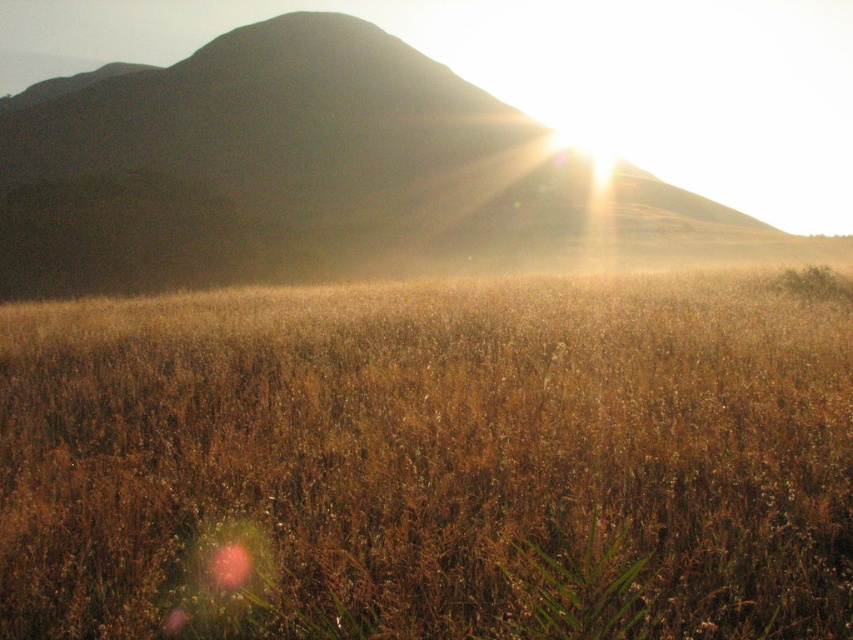
Question: Which of the following is the farthest from the observer?

Choices:
 (A) golden grassy field at center
 (B) silhouetted rock formation at upper center

Answer: (B)

Question: Can you confirm if golden grassy field at center is wider than silhouetted rock formation at upper center?

Choices:
 (A) no
 (B) yes

Answer: (A)

Question: Is golden grassy field at center below silhouetted rock formation at upper center?

Choices:
 (A) no
 (B) yes

Answer: (B)

Question: Can you confirm if golden grassy field at center is thinner than silhouetted rock formation at upper center?

Choices:
 (A) no
 (B) yes

Answer: (B)

Question: Among these objects, which one is farthest from the camera?

Choices:
 (A) golden grassy field at center
 (B) silhouetted rock formation at upper center

Answer: (B)